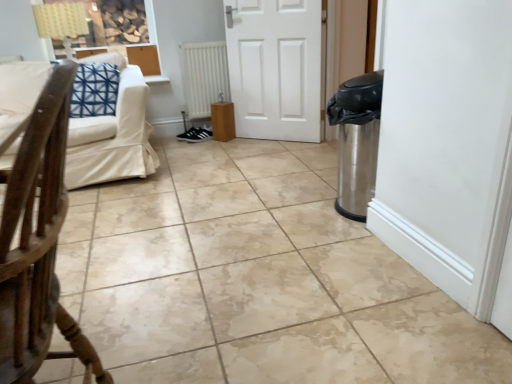
Question: Does white matte radiator at center have a larger size compared to beige fabric couch at upper left?

Choices:
 (A) yes
 (B) no

Answer: (B)

Question: From a real-world perspective, is white matte radiator at center located higher than beige fabric couch at upper left?

Choices:
 (A) yes
 (B) no

Answer: (B)

Question: From the image's perspective, is white matte radiator at center located beneath beige fabric couch at upper left?

Choices:
 (A) no
 (B) yes

Answer: (A)

Question: Is white matte radiator at center thinner than beige fabric couch at upper left?

Choices:
 (A) no
 (B) yes

Answer: (B)

Question: Is white matte radiator at center closer to camera compared to beige fabric couch at upper left?

Choices:
 (A) yes
 (B) no

Answer: (B)

Question: Would you say white matte radiator at center is a long distance from beige fabric couch at upper left?

Choices:
 (A) yes
 (B) no

Answer: (B)

Question: From a real-world perspective, is white matte radiator at center physically above black suede sneakers at center?

Choices:
 (A) no
 (B) yes

Answer: (B)

Question: Would you consider white matte radiator at center to be distant from black suede sneakers at center?

Choices:
 (A) yes
 (B) no

Answer: (B)

Question: Can you confirm if white matte radiator at center is positioned to the left of black suede sneakers at center?

Choices:
 (A) yes
 (B) no

Answer: (B)

Question: Does white matte radiator at center appear on the right side of black suede sneakers at center?

Choices:
 (A) no
 (B) yes

Answer: (B)

Question: Is white matte radiator at center with black suede sneakers at center?

Choices:
 (A) no
 (B) yes

Answer: (A)

Question: Is white matte radiator at center not inside black suede sneakers at center?

Choices:
 (A) yes
 (B) no

Answer: (A)

Question: Considering the relative positions of wooden chair at left and black suede sneakers at center in the image provided, is wooden chair at left to the left of black suede sneakers at center from the viewer's perspective?

Choices:
 (A) yes
 (B) no

Answer: (B)